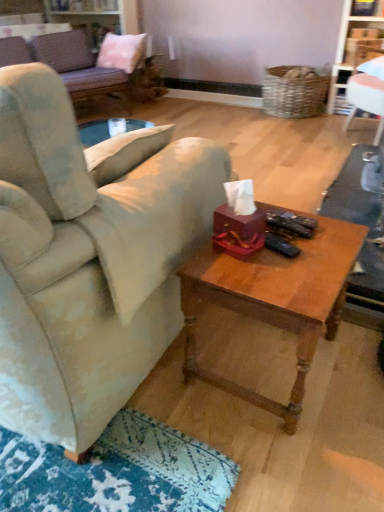
You are a GUI agent. You are given a task and a screenshot of the screen. Output one action in this format:
    pyautogui.click(x=<x>, y=<y>)
    Task: Click on the vacant area situated below wooden coffee table at center (from a real-world perspective)
    
    Given the screenshot: What is the action you would take?
    pyautogui.click(x=256, y=355)